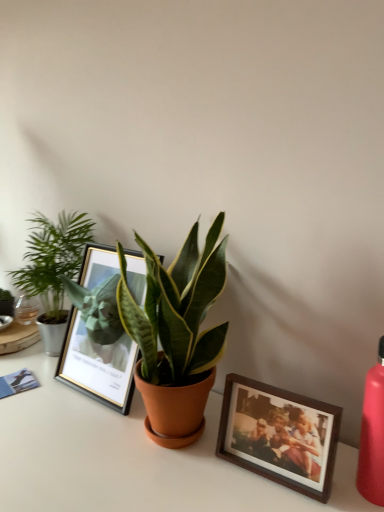
Where is `free point below green glossy houseplant at center, which ranks as the second houseplant in left-to-right order (from a real-world perspective)`? The image size is (384, 512). free point below green glossy houseplant at center, which ranks as the second houseplant in left-to-right order (from a real-world perspective) is located at coordinates (178, 438).